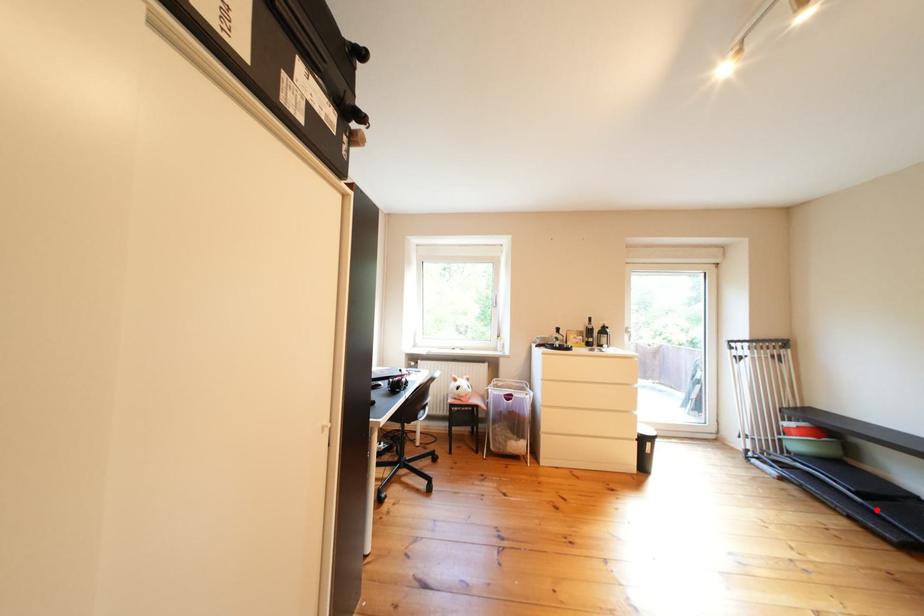
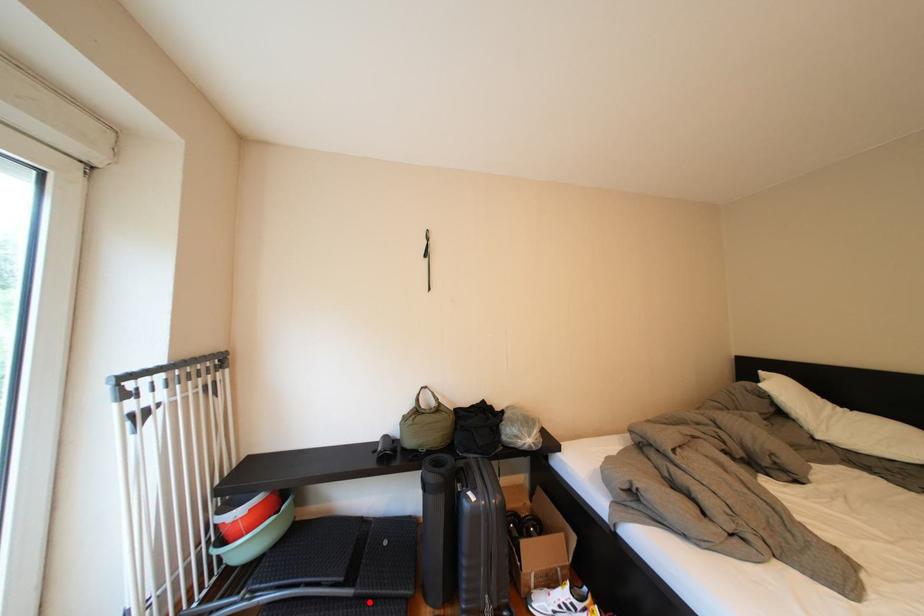
I am providing you with two images of the same scene from different viewpoints. A red point is marked on the first image and another point is marked on the second image. Is the red point in image1 aligned with the point shown in image2?

Yes